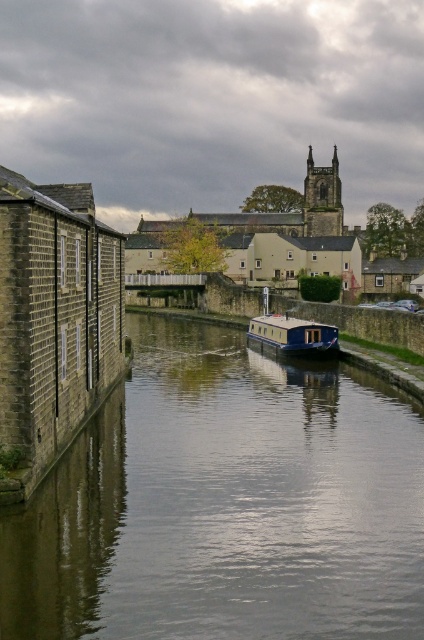
Which is above, smooth concrete canal at center or blue glossy houseboat at center?

blue glossy houseboat at center is higher up.

Is the position of smooth concrete canal at center more distant than that of blue glossy houseboat at center?

No, it is not.

Is point (407, 636) farther from camera compared to point (250, 321)?

No, it is in front of (250, 321).

Find the location of a particular element. This screenshot has width=424, height=640. smooth concrete canal at center is located at coordinates (225, 502).